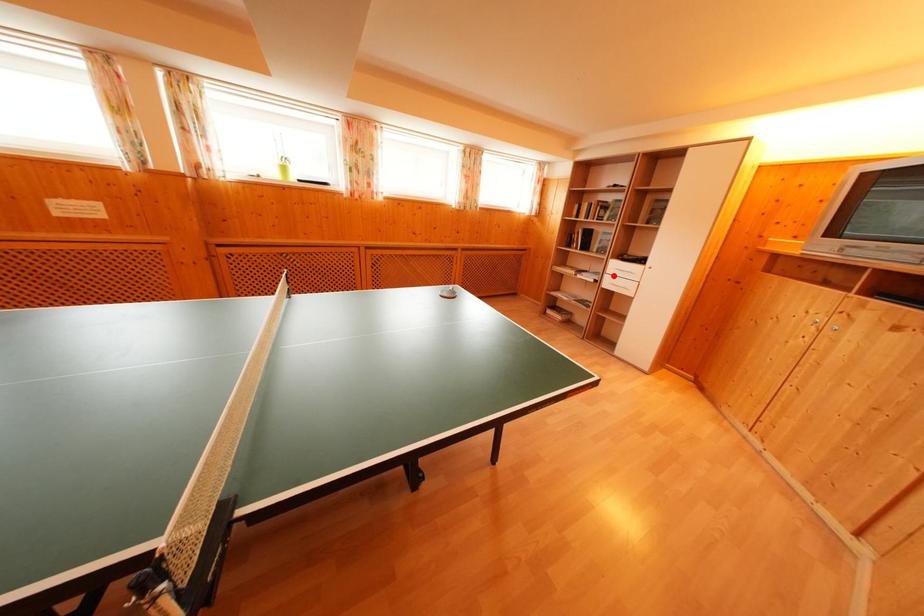
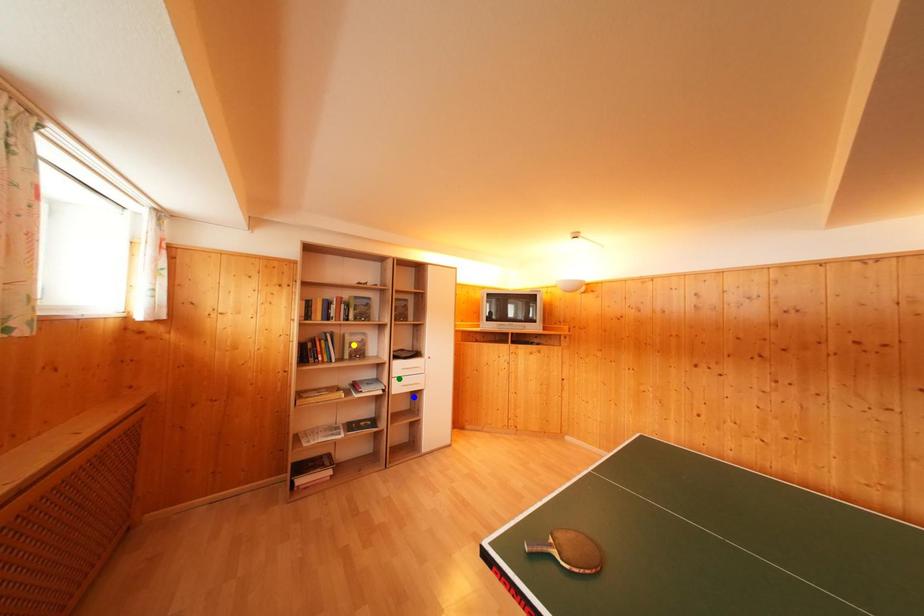
Question: I am providing you with two images of the same scene from different viewpoints. A red point is marked on the first image. You are given multiple points on the second image. Can you choose the point in image 2 that corresponds to the point in image 1?

Choices:
 (A) yellow point
 (B) blue point
 (C) green point

Answer: (C)